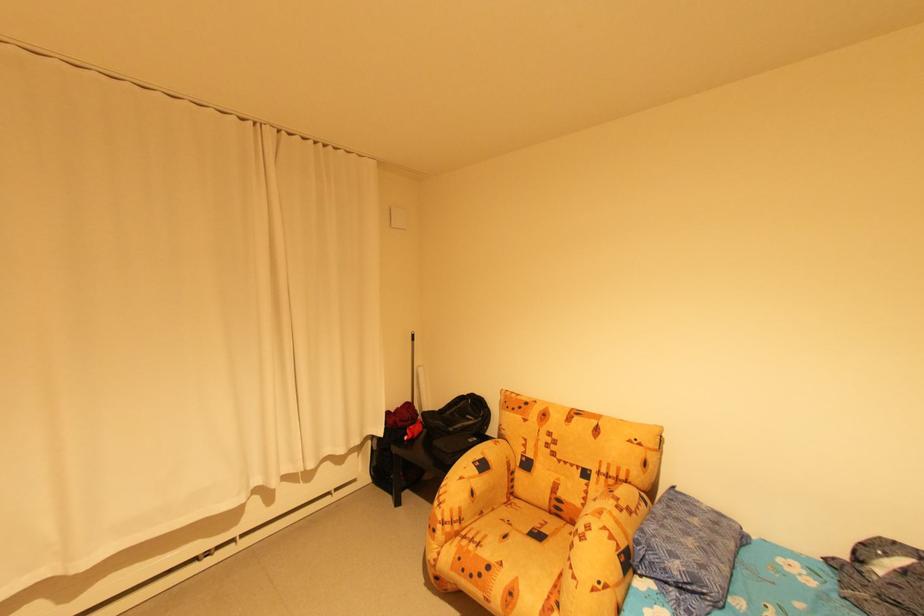
Locate an element on the screen. The height and width of the screenshot is (616, 924). chair sitting surface is located at coordinates (513, 541).